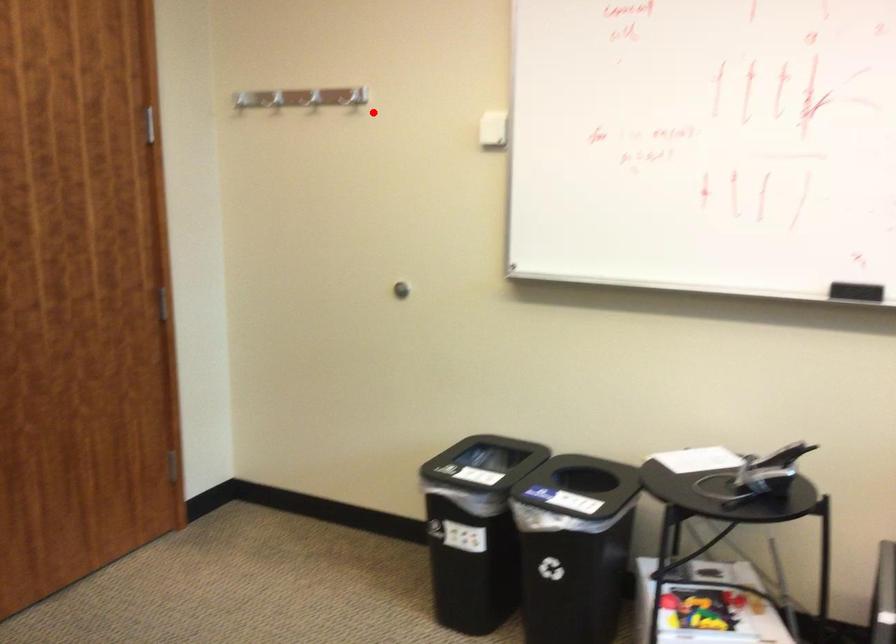
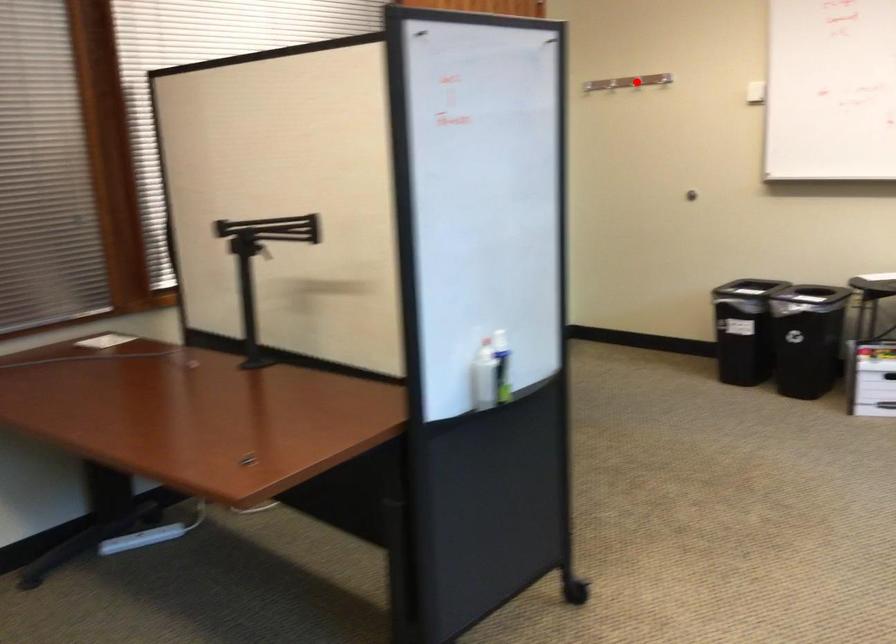
I am providing you with two images of the same scene from different viewpoints. A red point is marked on the first image and another point is marked on the second image. Is the marked point in image1 the same physical position as the marked point in image2?

No